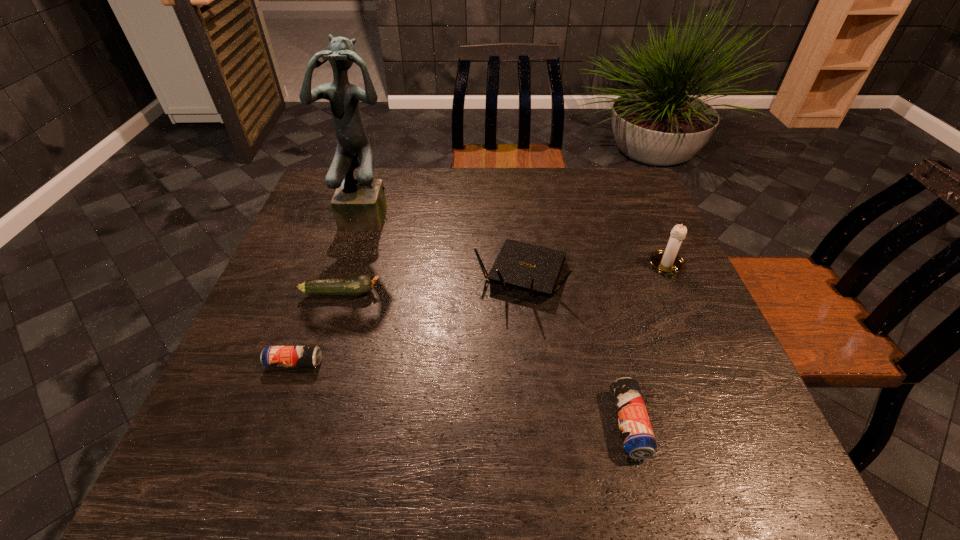
The image size is (960, 540). In order to click on sculpture that is at the left edge in this screenshot , I will do `click(359, 204)`.

Find the location of a particular element. The width and height of the screenshot is (960, 540). zucchini that is at the left edge is located at coordinates (357, 285).

Find the location of `object present at the right edge`. object present at the right edge is located at coordinates (667, 261).

Locate an element on the screen. This screenshot has height=540, width=960. object present at the far left corner is located at coordinates (359, 204).

This screenshot has width=960, height=540. In the image, there is a desktop. Identify the location of vacant space at the far edge. pos(436,180).

In the image, there is a desktop. Where is `vacant space at the left edge`? The height and width of the screenshot is (540, 960). vacant space at the left edge is located at coordinates (273, 274).

The height and width of the screenshot is (540, 960). I want to click on vacant space at the right edge of the desktop, so click(634, 219).

Identify the location of vacant area at the far left corner. (332, 198).

In the image, there is a desktop. At what (x,y) coordinates should I click in order to perform the action: click on free space at the far right corner. Please return your answer as a coordinate pair (x, y). Looking at the image, I should click on coord(635,184).

Where is `empty space that is in between the farthest object and the zucchini`? empty space that is in between the farthest object and the zucchini is located at coordinates (356, 253).